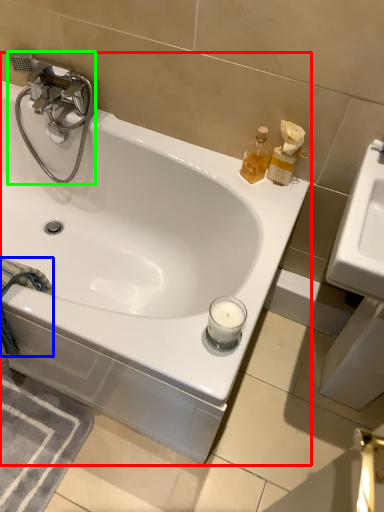
Question: Estimate the real-world distances between objects in this image. Which object is closer to bathtub (highlighted by a red box), bath towel (highlighted by a blue box) or tap (highlighted by a green box)?

Choices:
 (A) bath towel
 (B) tap

Answer: (B)